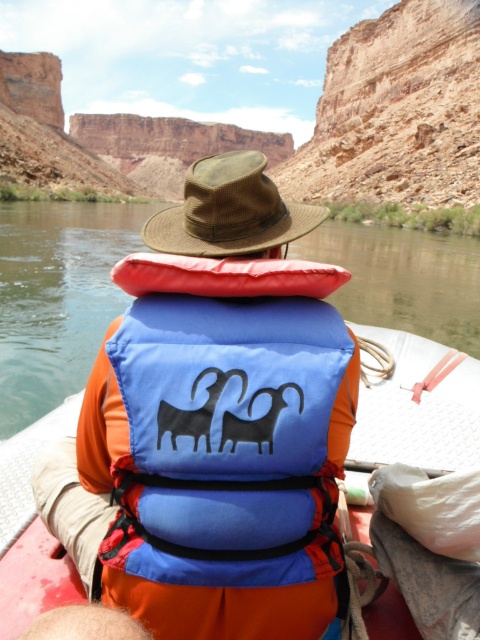
Question: Among these points, which one is nearest to the camera?

Choices:
 (A) (182, 529)
 (B) (176, 250)

Answer: (A)

Question: Can you confirm if green rubber raft at center is positioned to the left of brown woven hat at center?

Choices:
 (A) no
 (B) yes

Answer: (B)

Question: Does blue fabric life jacket at center appear on the right side of green rubber raft at center?

Choices:
 (A) yes
 (B) no

Answer: (A)

Question: Which is nearer to the blue fabric life jacket at center?

Choices:
 (A) brown woven hat at center
 (B) green rubber raft at center

Answer: (A)

Question: Is green rubber raft at center further to the viewer compared to brown woven hat at center?

Choices:
 (A) no
 (B) yes

Answer: (A)

Question: Which object is positioned farthest from the green rubber raft at center?

Choices:
 (A) brown woven hat at center
 (B) blue fabric life jacket at center

Answer: (A)